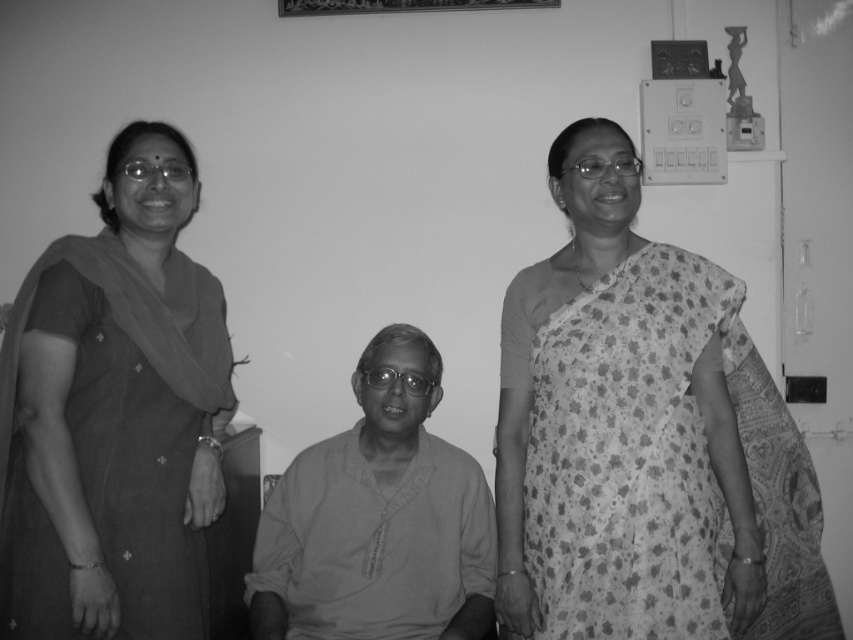
Question: Is smooth cotton kurta at center to the left of metallic rectangular frame at upper center from the viewer's perspective?

Choices:
 (A) no
 (B) yes

Answer: (B)

Question: Which object is the farthest from the matte black saree at left?

Choices:
 (A) metallic rectangular frame at upper center
 (B) metallic picture frame at upper right
 (C) smooth cotton kurta at center
 (D) printed cotton saree at right

Answer: (B)

Question: Among these objects, which one is nearest to the camera?

Choices:
 (A) matte black saree at left
 (B) metallic rectangular frame at upper center
 (C) printed cotton saree at right

Answer: (A)

Question: Does matte black saree at left appear over metallic picture frame at upper right?

Choices:
 (A) yes
 (B) no

Answer: (B)

Question: Is printed cotton saree at right to the right of smooth cotton kurta at center from the viewer's perspective?

Choices:
 (A) no
 (B) yes

Answer: (B)

Question: Based on their relative distances, which object is nearer to the metallic picture frame at upper right?

Choices:
 (A) matte black saree at left
 (B) printed cotton saree at right
 (C) smooth cotton kurta at center
 (D) metallic rectangular frame at upper center

Answer: (D)